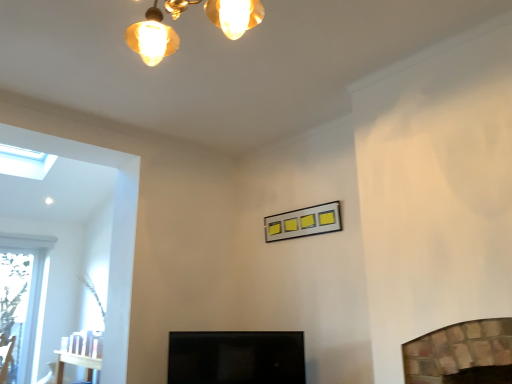
Describe the element at coordinates (25, 162) in the screenshot. I see `transparent glass skylight at upper left` at that location.

Locate an element on the screen. black glossy screen door at center is located at coordinates (236, 357).

From the image's perspective, is black glossy screen door at center below transparent glass skylight at upper left?

Yes, from the image's perspective, black glossy screen door at center is below transparent glass skylight at upper left.

Which object is closer to the camera taking this photo, black glossy screen door at center or transparent glass skylight at upper left?

Positioned in front is black glossy screen door at center.

Is black glossy screen door at center aimed at transparent glass skylight at upper left?

No, black glossy screen door at center is not aimed at transparent glass skylight at upper left.

Can you tell me how much metallic silver picture frame at center and black glossy screen door at center differ in facing direction?

The angular difference between metallic silver picture frame at center and black glossy screen door at center is 31.3 degrees.

Does metallic silver picture frame at center come in front of black glossy screen door at center?

No, metallic silver picture frame at center is behind black glossy screen door at center.

Based on the photo, is metallic silver picture frame at center at the right side of black glossy screen door at center?

Yes.

From the image's perspective, who appears lower, metallic silver picture frame at center or black glossy screen door at center?

black glossy screen door at center is shown below in the image.

Which of these two, black glossy screen door at center or metallic silver picture frame at center, stands taller?

Standing taller between the two is black glossy screen door at center.

Considering the positions of objects black glossy screen door at center and metallic silver picture frame at center in the image provided, who is more to the right, black glossy screen door at center or metallic silver picture frame at center?

metallic silver picture frame at center.

This screenshot has height=384, width=512. What are the coordinates of `picture frame on the right of the black glossy screen door at center` in the screenshot? It's located at (303, 222).

From a real-world perspective, which is physically below, black glossy screen door at center or metallic silver picture frame at center?

In real-world perspective, black glossy screen door at center is lower.

Consider the image. Can you confirm if transparent glass skylight at upper left is thinner than metallic silver picture frame at center?

No, transparent glass skylight at upper left is not thinner than metallic silver picture frame at center.

Is transparent glass skylight at upper left shorter than metallic silver picture frame at center?

No, transparent glass skylight at upper left is not shorter than metallic silver picture frame at center.

Can you tell me how much transparent glass skylight at upper left and metallic silver picture frame at center differ in facing direction?

The facing directions of transparent glass skylight at upper left and metallic silver picture frame at center are 85.6 degrees apart.

From a real-world perspective, is metallic silver picture frame at center positioned above or below transparent glass skylight at upper left?

Clearly, from a real-world perspective, metallic silver picture frame at center is below transparent glass skylight at upper left.

Where is `picture frame to the right of transparent glass skylight at upper left`? Image resolution: width=512 pixels, height=384 pixels. picture frame to the right of transparent glass skylight at upper left is located at coordinates (303, 222).

Could you measure the distance between metallic silver picture frame at center and transparent glass skylight at upper left?

2.49 meters.

Is metallic silver picture frame at center facing towards transparent glass skylight at upper left?

No, metallic silver picture frame at center does not turn towards transparent glass skylight at upper left.

From the image's perspective, relative to black glossy screen door at center, is transparent glass skylight at upper left above or below?

Based on their image positions, transparent glass skylight at upper left is located above black glossy screen door at center.

Do you think transparent glass skylight at upper left is within black glossy screen door at center, or outside of it?

transparent glass skylight at upper left exists outside the volume of black glossy screen door at center.

How distant is transparent glass skylight at upper left from black glossy screen door at center?

They are 8.33 feet apart.

Is transparent glass skylight at upper left next to black glossy screen door at center?

No.

At what (x,y) coordinates should I click in order to perform the action: click on screen door located on the right of transparent glass skylight at upper left. Please return your answer as a coordinate pair (x, y). This screenshot has height=384, width=512. Looking at the image, I should click on (236, 357).

Where is `screen door that is in front of the metallic silver picture frame at center`? This screenshot has width=512, height=384. screen door that is in front of the metallic silver picture frame at center is located at coordinates (236, 357).

When comparing their distances from transparent glass skylight at upper left, does black glossy screen door at center or metallic silver picture frame at center seem further?

black glossy screen door at center is further to transparent glass skylight at upper left.

Based on their spatial positions, is metallic silver picture frame at center or black glossy screen door at center closer to transparent glass skylight at upper left?

Among the two, metallic silver picture frame at center is located nearer to transparent glass skylight at upper left.

Estimate the real-world distances between objects in this image. Which object is closer to black glossy screen door at center, metallic silver picture frame at center or transparent glass skylight at upper left?

metallic silver picture frame at center lies closer to black glossy screen door at center than the other object.

When comparing their distances from metallic silver picture frame at center, does black glossy screen door at center or transparent glass skylight at upper left seem further?

transparent glass skylight at upper left is positioned further to the anchor metallic silver picture frame at center.

From the image, which object appears to be nearer to black glossy screen door at center, transparent glass skylight at upper left or metallic silver picture frame at center?

Among the two, metallic silver picture frame at center is located nearer to black glossy screen door at center.

Which object lies further to the anchor point metallic silver picture frame at center, transparent glass skylight at upper left or black glossy screen door at center?

Based on the image, transparent glass skylight at upper left appears to be further to metallic silver picture frame at center.

The height and width of the screenshot is (384, 512). I want to click on screen door between transparent glass skylight at upper left and metallic silver picture frame at center in the horizontal direction, so click(x=236, y=357).